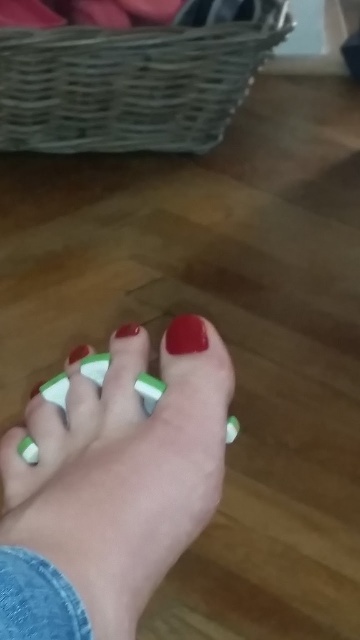
Is point (182, 337) behind point (124, 333)?

That is False.

Can you confirm if glossy red nail at center is positioned above green matte nail at center?

Yes, glossy red nail at center is above green matte nail at center.

The height and width of the screenshot is (640, 360). Identify the location of glossy red nail at center. click(x=186, y=336).

Who is higher up, green matte nail polish at center or glossy red nail at center?

glossy red nail at center

At what (x,y) coordinates should I click in order to perform the action: click on green matte nail polish at center. Please return your answer as a coordinate pair (x, y). Looking at the image, I should click on (110, 492).

Where is `green matte nail polish at center`? green matte nail polish at center is located at coordinates (110, 492).

Is point (16, 525) positioned in front of point (185, 138)?

Yes, point (16, 525) is in front of point (185, 138).

Which is above, green matte nail polish at center or woven wicker basket at upper left?

woven wicker basket at upper left

Who is more forward, (x=137, y=337) or (x=219, y=52)?

Point (x=137, y=337)

Locate an element on the screen. green matte nail polish at center is located at coordinates (110, 492).